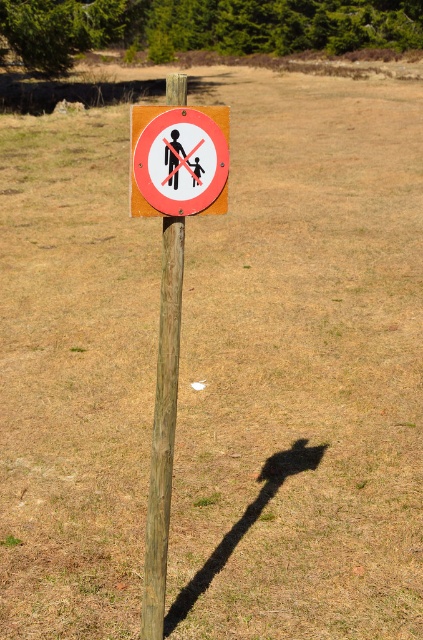
You are standing at the origin point of the coordinate system. Where is the red plastic sign at center located?

The red plastic sign at center is located at point (178, 161).

You are a hiker who needs to attach a small notice to the lower part of the wooden post at center. The notice is 10 cm in height. Can the red plastic sign at center be used as a reference point to ensure the notice is placed below it?

The red plastic sign at center is not as tall as the wooden post at center, so the notice can be placed below the red plastic sign at center as long as it is within the lower part of the wooden post at center.

From the picture: You are a hiker who wants to take a photo of the red plastic sign at center and the wooden post at center. Which object should you focus on first if you want to include both in your photo without moving your camera position?

The red plastic sign at center is smaller than the wooden post at center, so you should focus on the wooden post at center first to ensure it fits in the frame before adjusting for the smaller sign.